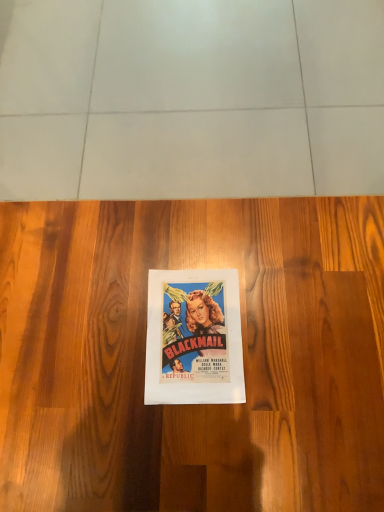
At what (x,y) coordinates should I click in order to perform the action: click on vacant area located to the right-hand side of matte paper poster at center. Please return your answer as a coordinate pair (x, y). Image resolution: width=384 pixels, height=512 pixels. Looking at the image, I should click on (294, 319).